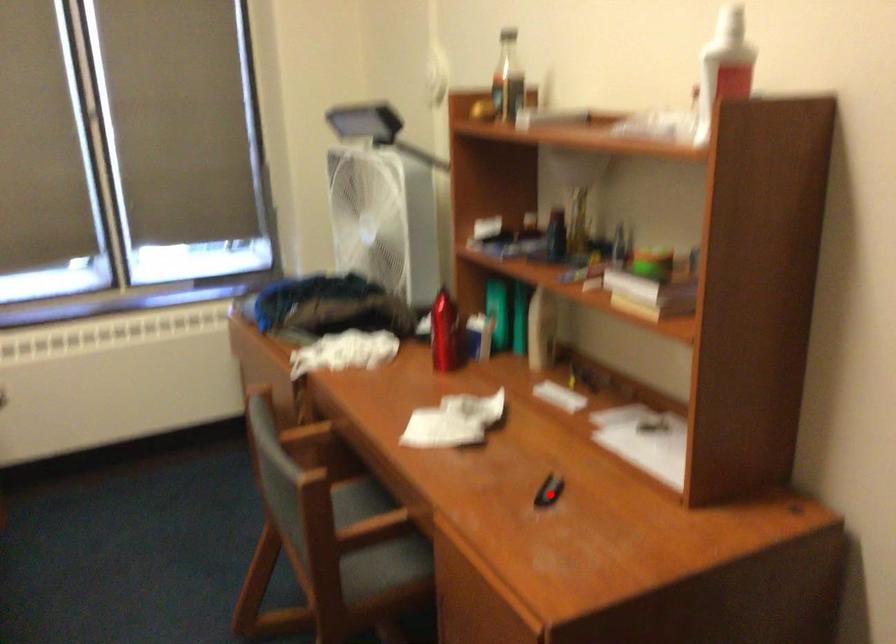
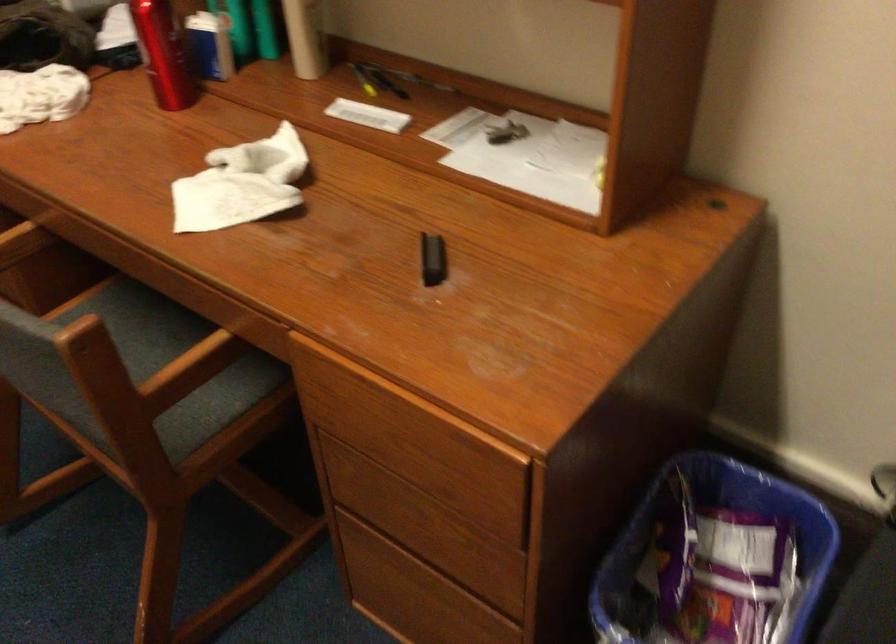
Find the pixel in the second image that matches the highlighted location in the first image.

(433, 259)